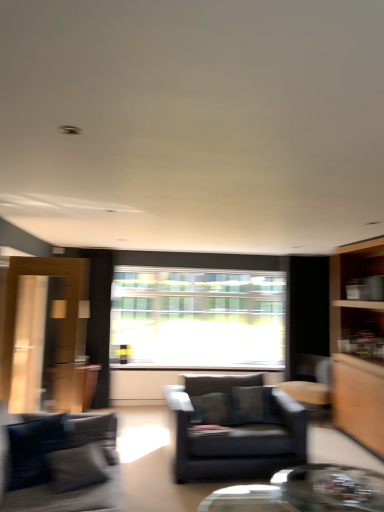
Question: From a real-world perspective, is dark blue fabric couch at lower left below transparent glass coffee table at lower center?

Choices:
 (A) yes
 (B) no

Answer: (B)

Question: Considering the relative sizes of dark blue fabric couch at lower left and transparent glass coffee table at lower center in the image provided, is dark blue fabric couch at lower left taller than transparent glass coffee table at lower center?

Choices:
 (A) yes
 (B) no

Answer: (A)

Question: Considering the relative positions of dark blue fabric couch at lower left and transparent glass coffee table at lower center in the image provided, is dark blue fabric couch at lower left to the left of transparent glass coffee table at lower center from the viewer's perspective?

Choices:
 (A) no
 (B) yes

Answer: (B)

Question: Is transparent glass coffee table at lower center at the back of dark blue fabric couch at lower left?

Choices:
 (A) yes
 (B) no

Answer: (B)

Question: Considering the relative sizes of dark blue fabric couch at lower left and transparent glass coffee table at lower center in the image provided, is dark blue fabric couch at lower left wider than transparent glass coffee table at lower center?

Choices:
 (A) no
 (B) yes

Answer: (A)

Question: Is dark blue fabric couch at lower left completely or partially outside of transparent glass coffee table at lower center?

Choices:
 (A) no
 (B) yes

Answer: (B)

Question: Can transparent glass window at center be found inside matte black armchair at center?

Choices:
 (A) no
 (B) yes

Answer: (A)

Question: Considering the relative sizes of matte black armchair at center and transparent glass window at center in the image provided, is matte black armchair at center shorter than transparent glass window at center?

Choices:
 (A) yes
 (B) no

Answer: (A)

Question: Is the position of matte black armchair at center less distant than that of transparent glass window at center?

Choices:
 (A) no
 (B) yes

Answer: (B)

Question: Is matte black armchair at center positioned with its back to transparent glass window at center?

Choices:
 (A) no
 (B) yes

Answer: (B)

Question: Can you confirm if matte black armchair at center is smaller than transparent glass window at center?

Choices:
 (A) yes
 (B) no

Answer: (B)

Question: Does matte black armchair at center touch transparent glass window at center?

Choices:
 (A) yes
 (B) no

Answer: (B)

Question: Is transparent glass window at center surrounding transparent glass coffee table at lower center?

Choices:
 (A) no
 (B) yes

Answer: (A)